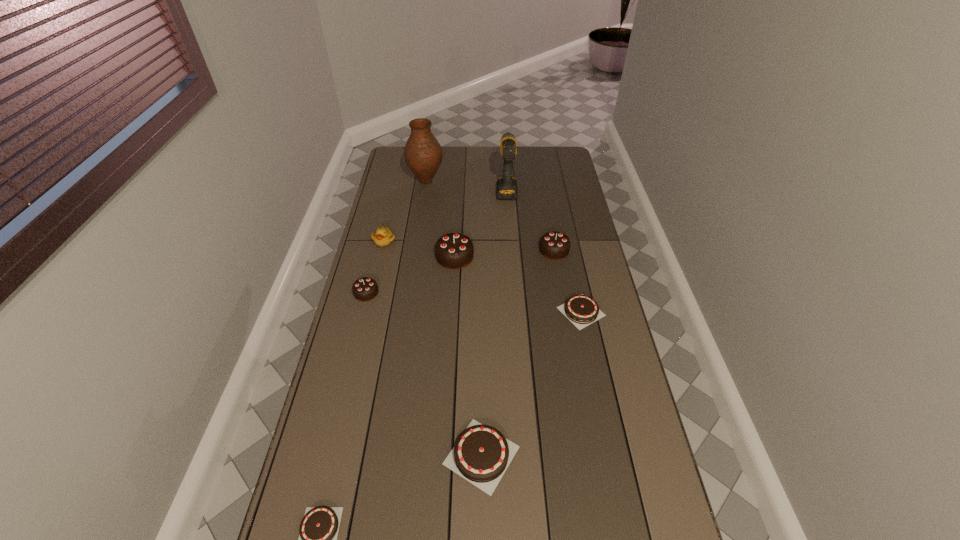
This screenshot has width=960, height=540. I want to click on the biggest brown chocolate cake, so click(x=481, y=455).

Find the location of `the rightmost brown chocolate cake`. the rightmost brown chocolate cake is located at coordinates (581, 310).

Where is `the second shortest object`? The image size is (960, 540). the second shortest object is located at coordinates (581, 310).

The width and height of the screenshot is (960, 540). In order to click on free space located 0.360m on the right of the vase in this screenshot , I will do `click(519, 181)`.

The height and width of the screenshot is (540, 960). I want to click on vacant space located 0.170m with the drill bit of the drill facing forward, so click(504, 158).

Image resolution: width=960 pixels, height=540 pixels. Identify the location of free space located with the drill bit of the drill facing forward. (504, 157).

I want to click on free space located 0.100m with the drill bit of the drill facing forward, so click(505, 165).

Find the location of a particular element. The image size is (960, 540). vacant space located on the back of the biggest chocolate chocolate cake is located at coordinates (457, 213).

Where is `vacant space located 0.230m on the left of the second tallest chocolate cake`? The image size is (960, 540). vacant space located 0.230m on the left of the second tallest chocolate cake is located at coordinates (481, 250).

Where is `free space located 0.170m on the front-facing side of the duckling`? free space located 0.170m on the front-facing side of the duckling is located at coordinates click(375, 279).